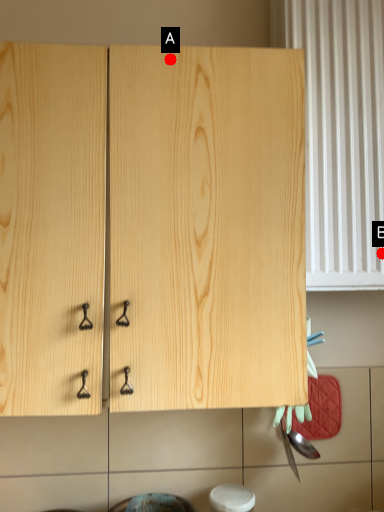
Question: Two points are circled on the image, labeled by A and B beside each circle. Which point is closer to the camera taking this photo?

Choices:
 (A) A is closer
 (B) B is closer

Answer: (A)